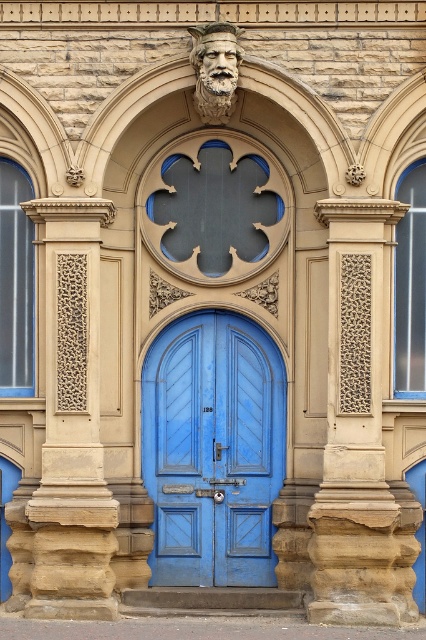
Does beige textured stone pillar at center have a lesser height compared to sandstone textured column at left?

No, beige textured stone pillar at center is not shorter than sandstone textured column at left.

This screenshot has height=640, width=426. I want to click on beige textured stone pillar at center, so click(359, 440).

Locate an element on the screen. The width and height of the screenshot is (426, 640). beige textured stone pillar at center is located at coordinates (359, 440).

In order to click on beige textured stone pillar at center in this screenshot , I will do `click(359, 440)`.

Between matte blue door at center and sandstone textured column at left, which one appears on the right side from the viewer's perspective?

matte blue door at center

Is point (273, 392) positioned after point (106, 483)?

Yes, point (273, 392) is farther from viewer.

Locate an element on the screen. Image resolution: width=426 pixels, height=640 pixels. matte blue door at center is located at coordinates (213, 449).

Who is positioned more to the right, matte blue door at center or beige textured stone pillar at center?

beige textured stone pillar at center

Between point (158, 554) and point (322, 506), which one is positioned behind?

Positioned behind is point (158, 554).

Locate an element on the screen. matte blue door at center is located at coordinates (213, 449).